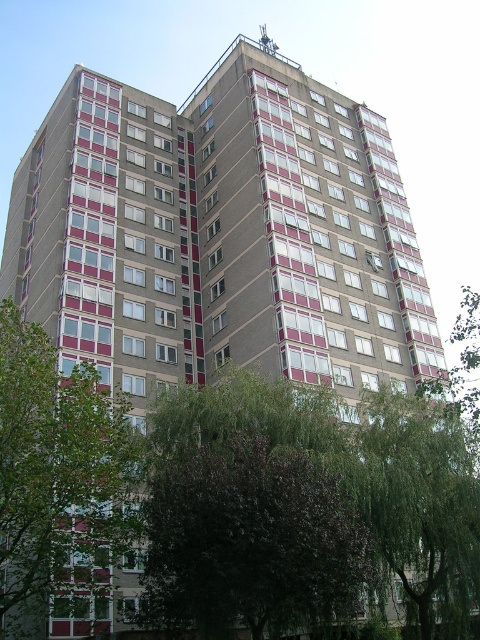
Does dark purple leafy tree at center appear on the left side of green leafy tree at lower right?

Correct, you'll find dark purple leafy tree at center to the left of green leafy tree at lower right.

Who is positioned more to the left, dark purple leafy tree at center or green leafy tree at lower right?

Positioned to the left is dark purple leafy tree at center.

The height and width of the screenshot is (640, 480). Describe the element at coordinates (251, 541) in the screenshot. I see `dark purple leafy tree at center` at that location.

At what (x,y) coordinates should I click in order to perform the action: click on dark purple leafy tree at center. Please return your answer as a coordinate pair (x, y). Looking at the image, I should click on (251, 541).

Between dark purple leafy tree at center and green leafy tree at left, which one has less height?

dark purple leafy tree at center is shorter.

Does dark purple leafy tree at center have a lesser width compared to green leafy tree at left?

No, dark purple leafy tree at center is not thinner than green leafy tree at left.

At what (x,y) coordinates should I click in order to perform the action: click on dark purple leafy tree at center. Please return your answer as a coordinate pair (x, y). This screenshot has width=480, height=640. Looking at the image, I should click on (251, 541).

Does green leafy tree at left have a greater height compared to green leafy tree at lower right?

Correct, green leafy tree at left is much taller as green leafy tree at lower right.

What do you see at coordinates (60, 484) in the screenshot? This screenshot has width=480, height=640. I see `green leafy tree at left` at bounding box center [60, 484].

In order to click on green leafy tree at left in this screenshot , I will do `click(60, 484)`.